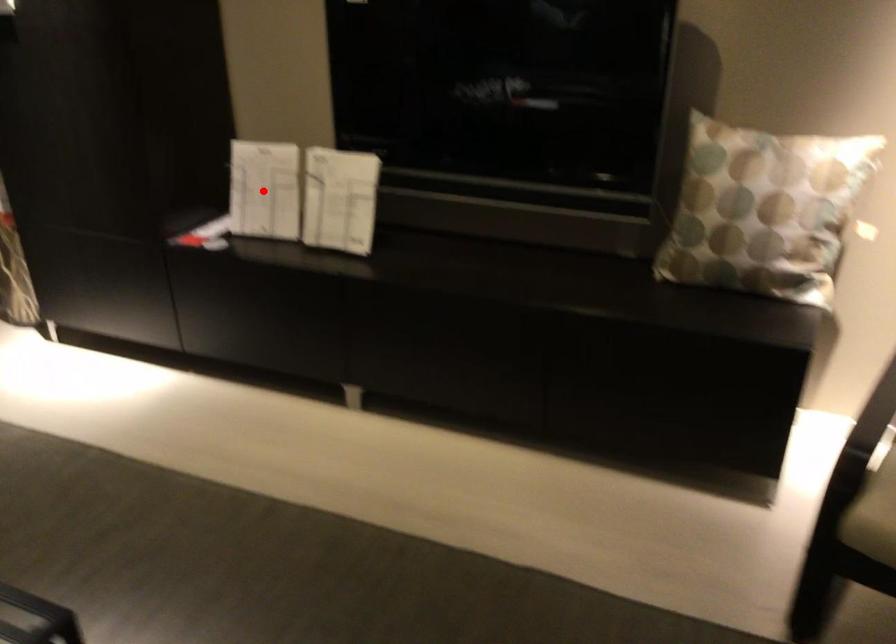
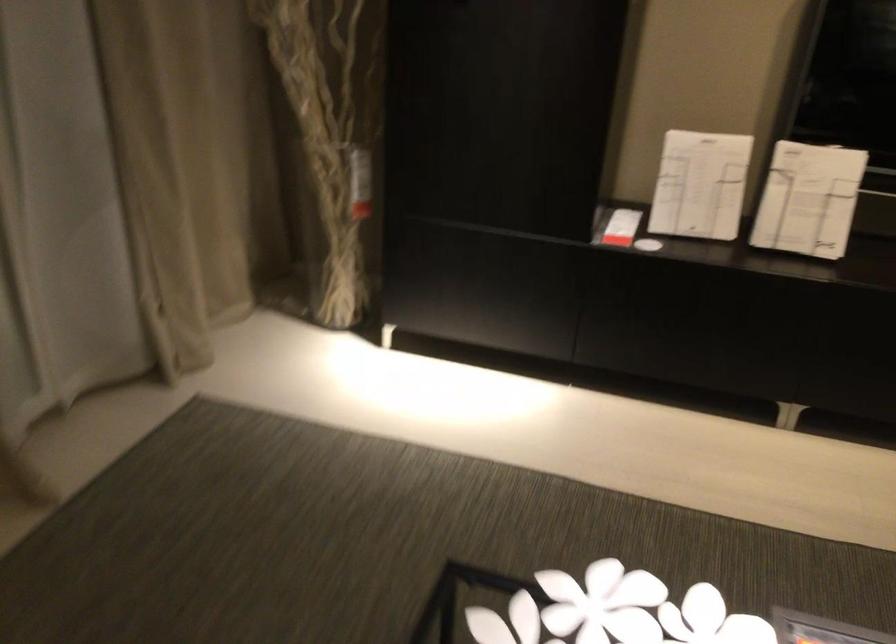
In the second image, find the point that corresponds to the highlighted location in the first image.

(700, 185)